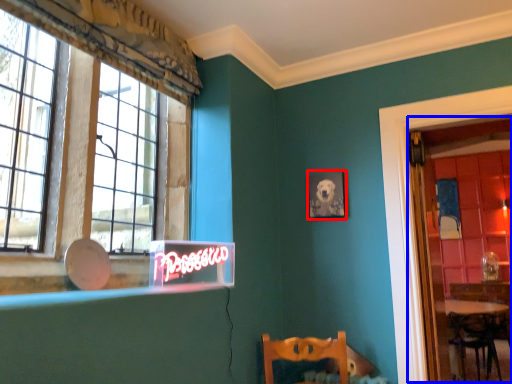
Question: Which point is closer to the camera, picture frame (highlighted by a red box) or glass door (highlighted by a blue box)?

Choices:
 (A) picture frame
 (B) glass door

Answer: (B)